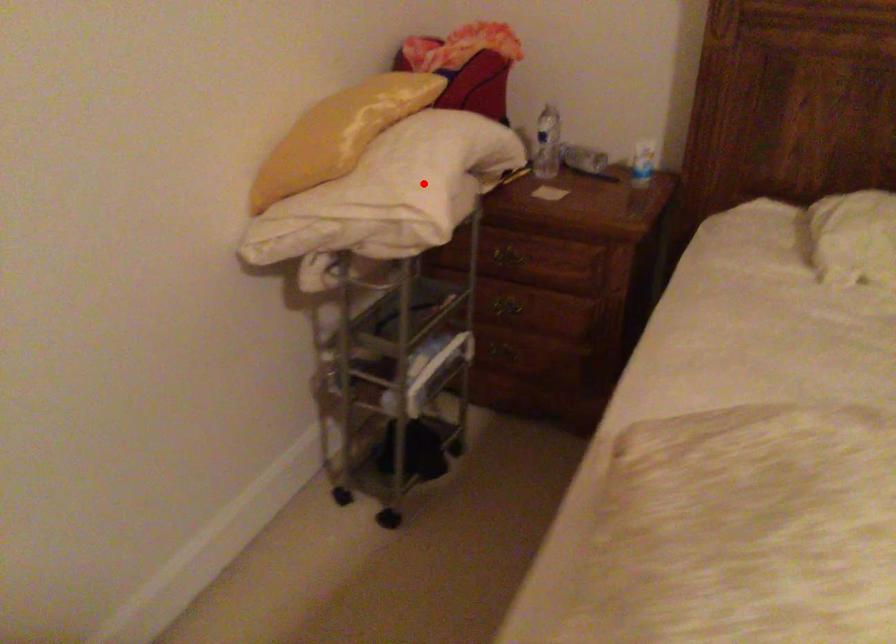
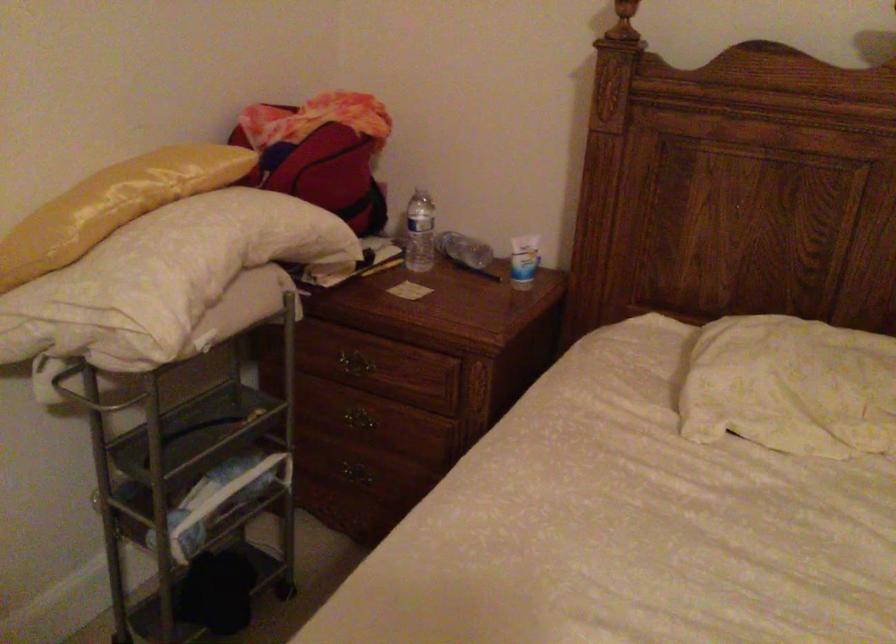
Where in the second image is the point corresponding to the highlighted location from the first image?

(164, 278)